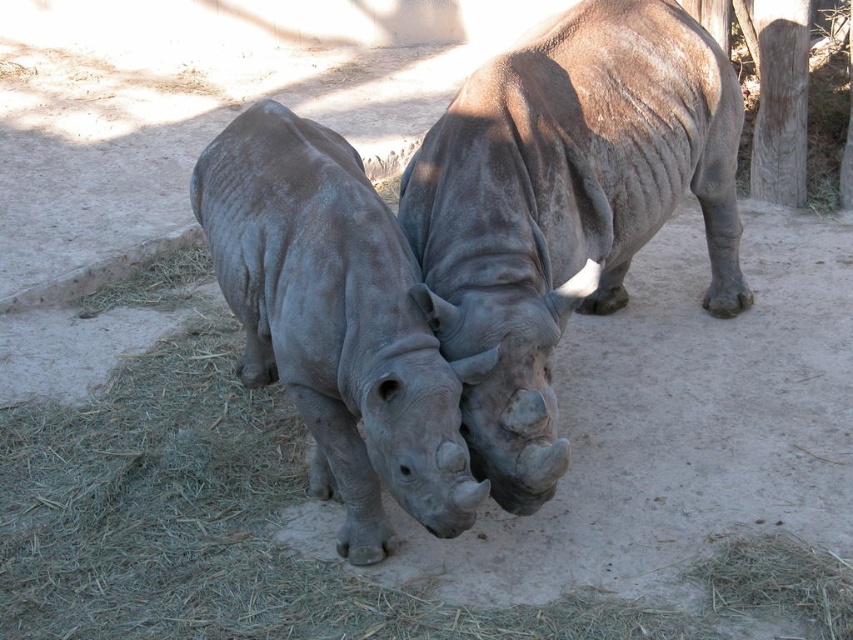
You are a zookeeper who needs to separate the two rhinos into different enclosures. You have a 2.5 meter wide gate. The path between the two rhinos is narrow. Can the gate fit through the path between the gray textured rhino at center and the gray matte rhinoceros at center?

The path between the gray textured rhino at center and the gray matte rhinoceros at center is narrow, but the gate is 2.5 meters wide. However, the description does not provide the width of the path, so it is impossible to determine if the gate can fit through.